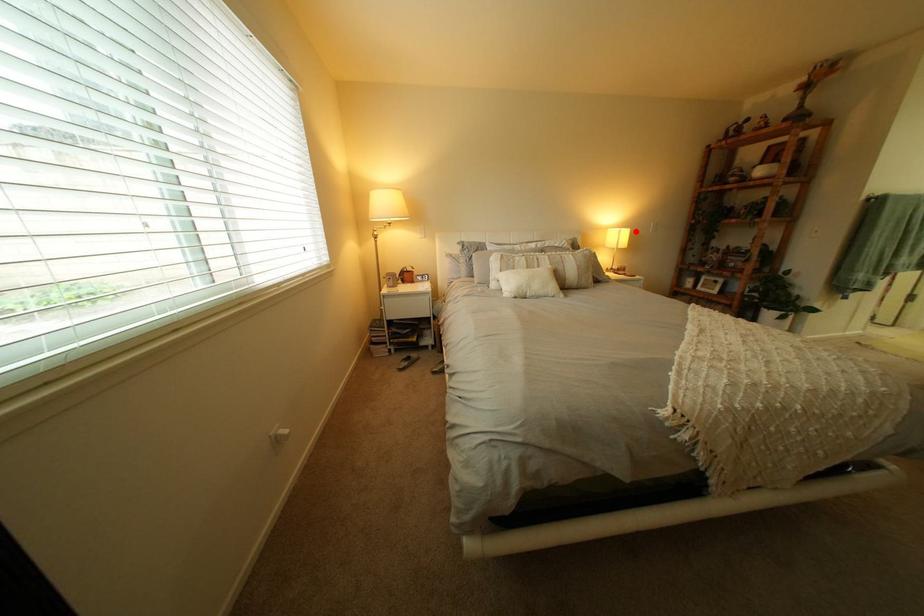
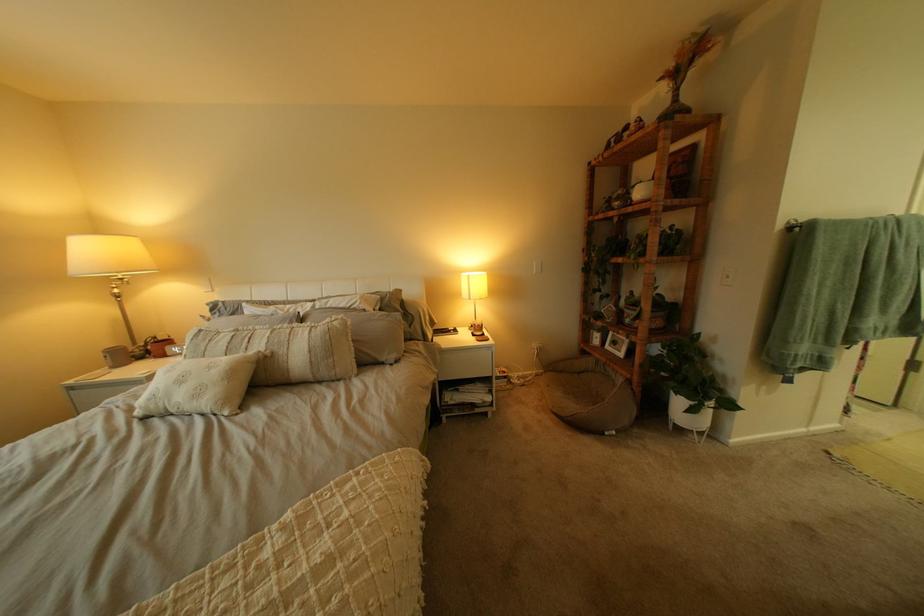
Question: I am providing you with two images of the same scene from different viewpoints. Image1 has a red point marked. In image2, the corresponding 3D location appears at what relative position? Reply with the corresponding letter.

Choices:
 (A) Closer
 (B) Farther

Answer: (B)